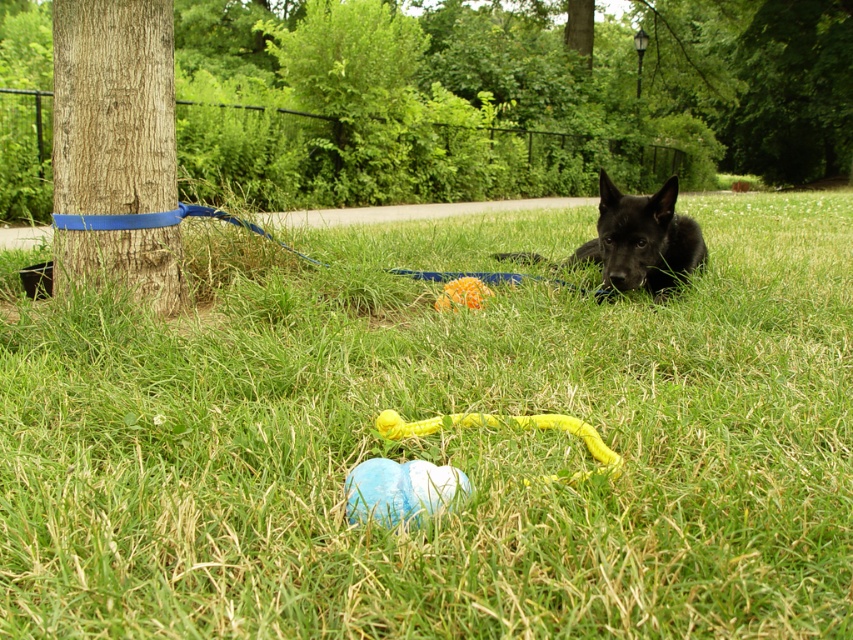
You are standing in the park and want to pick up the object at point (100, 189). Is it within your reach without moving your feet?

The point (100, 189) is 10.79 feet away from you, so it is too far to reach without moving your feet.